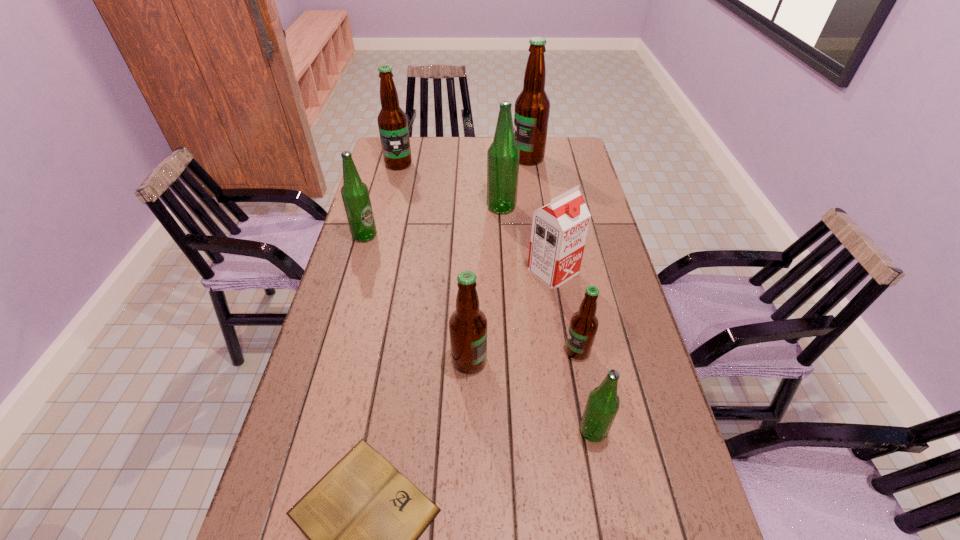
Find the location of a particular element. This screenshot has width=960, height=540. the biggest brown beer bottle is located at coordinates [x=532, y=107].

You are a GUI agent. You are given a task and a screenshot of the screen. Output one action in this format:
    pyautogui.click(x=<x>, y=<y>)
    Task: Click on the tallest object
    Image resolution: width=960 pixels, height=540 pixels.
    Given the screenshot: What is the action you would take?
    pyautogui.click(x=532, y=107)

Locate an element on the screen. the fourth beer bottle from right to left is located at coordinates (503, 155).

At what (x,y) coordinates should I click in order to perform the action: click on the biggest green beer bottle. Please return your answer as a coordinate pair (x, y). The height and width of the screenshot is (540, 960). Looking at the image, I should click on (503, 155).

You are a GUI agent. You are given a task and a screenshot of the screen. Output one action in this format:
    pyautogui.click(x=<x>, y=<y>)
    Task: Click on the leftmost brown beer bottle
    This screenshot has width=960, height=540.
    Given the screenshot: What is the action you would take?
    pyautogui.click(x=392, y=121)

Identify the location of the second brown beer bottle from left to right. (468, 324).

Where is `the fifth beer bottle from right to left`? the fifth beer bottle from right to left is located at coordinates (468, 324).

This screenshot has height=540, width=960. Identify the location of the second farthest green beer bottle. (355, 194).

This screenshot has height=540, width=960. Identify the location of the leftmost green beer bottle. (355, 194).

I want to click on the fifth farthest object, so click(559, 230).